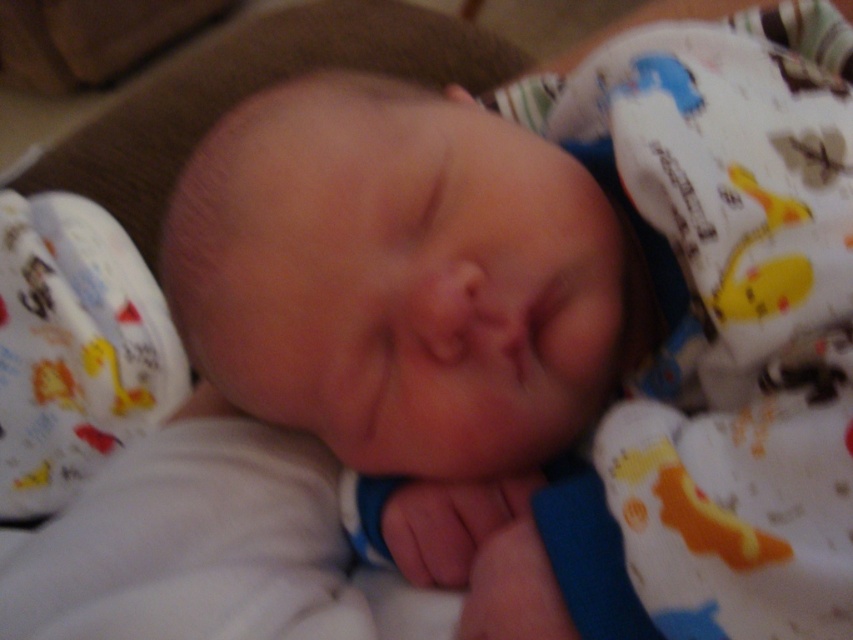
Question: Which point is closer to the camera taking this photo?

Choices:
 (A) (781, 129)
 (B) (567, 292)

Answer: (B)

Question: Does white soft newborn at center have a smaller size compared to white cotton blanket at center?

Choices:
 (A) no
 (B) yes

Answer: (B)

Question: Does white soft newborn at center appear under white cotton blanket at center?

Choices:
 (A) no
 (B) yes

Answer: (B)

Question: Observing the image, what is the correct spatial positioning of white soft newborn at center in reference to white cotton blanket at center?

Choices:
 (A) right
 (B) left

Answer: (B)

Question: Which point is farther from the camera taking this photo?

Choices:
 (A) (843, 602)
 (B) (117, 536)

Answer: (B)

Question: Which object appears farthest from the camera in this image?

Choices:
 (A) white cotton blanket at center
 (B) white soft newborn at center

Answer: (B)